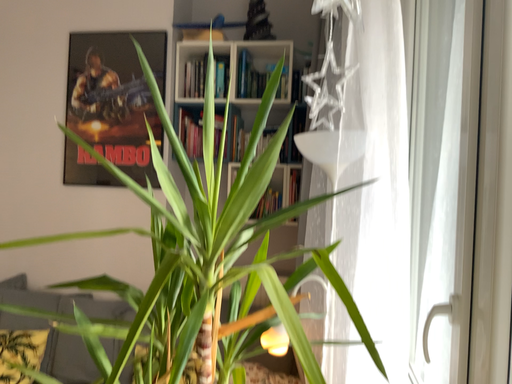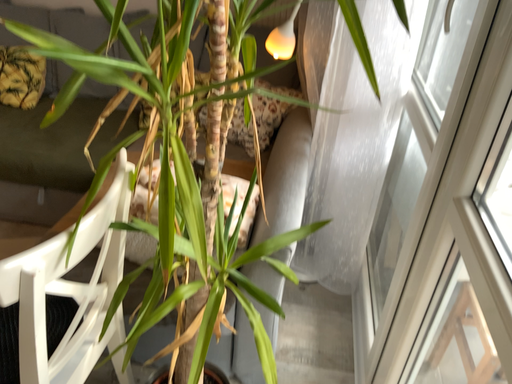
Question: How did the camera likely rotate when shooting the video?

Choices:
 (A) rotated upward
 (B) rotated downward

Answer: (B)